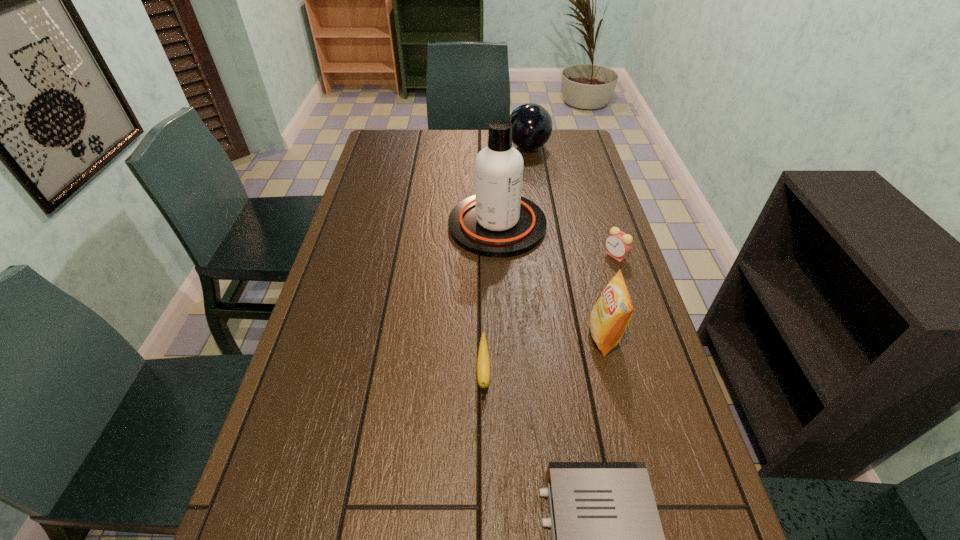
At what (x,y) coordinates should I click in order to perform the action: click on the tallest object. Please return your answer as a coordinate pair (x, y). Looking at the image, I should click on (497, 222).

Find the location of a particular element. the farthest object is located at coordinates (532, 125).

This screenshot has height=540, width=960. In order to click on crisp (potato chip) in this screenshot , I will do `click(608, 319)`.

You are a GUI agent. You are given a task and a screenshot of the screen. Output one action in this format:
    pyautogui.click(x=<x>, y=<y>)
    Task: Click on the rightmost object
    The width and height of the screenshot is (960, 540).
    Given the screenshot: What is the action you would take?
    pyautogui.click(x=618, y=244)

This screenshot has height=540, width=960. I want to click on banana, so click(483, 363).

This screenshot has width=960, height=540. What are the coordinates of `free space located on the right of the cleansing agent` in the screenshot? It's located at pos(584,225).

Locate an element on the screen. vacant space located on the side of the farthest object with the finger holes is located at coordinates (431, 147).

Identify the location of vacant space located 0.080m on the side of the farthest object with the finger holes. The width and height of the screenshot is (960, 540). (487, 147).

The height and width of the screenshot is (540, 960). Identify the location of free location located 0.320m on the side of the farthest object with the finger holes. (426, 147).

You are a GUI agent. You are given a task and a screenshot of the screen. Output one action in this format:
    pyautogui.click(x=<x>, y=<y>)
    Task: Click on the free point located 0.340m on the front-facing side of the crisp (potato chip)
    The height and width of the screenshot is (540, 960).
    Given the screenshot: What is the action you would take?
    pyautogui.click(x=451, y=336)